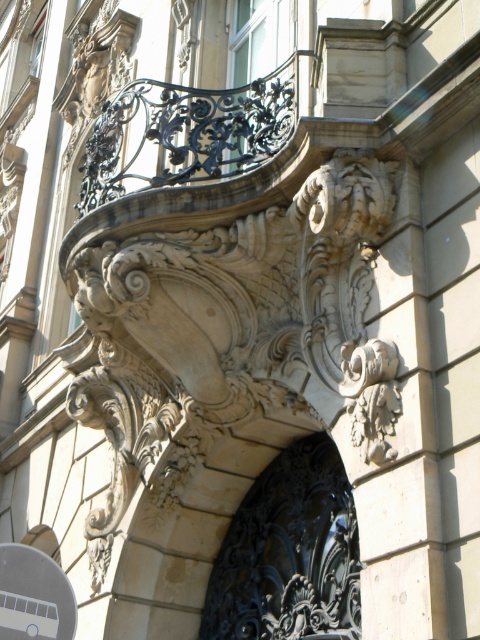
You are a photographer planning to capture a photo of the white plastic bus at lower left and the white stone carving at center. Based on their sizes, which object should you focus on first if you want to ensure both are in frame without moving the camera?

The white plastic bus at lower left is not as tall as the white stone carving at center, so you should focus on the white stone carving at center first to ensure it fits within the frame, as it is larger.

You are an architect designing a restoration project for this historical building. You need to ensure that the black wrought iron door at center and the white stone carving at center are proportionate. Based on their current heights, which object should you adjust to achieve better proportionality?

The black wrought iron door at center has a lesser height compared to the white stone carving at center, so you should increase the height of the black wrought iron door at center to match the white stone carving at center for better proportionality.